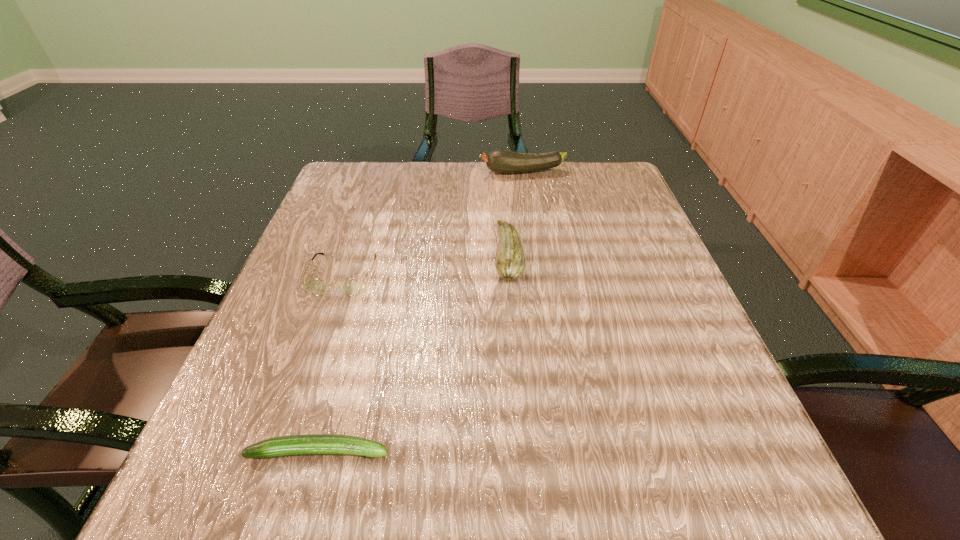
Where is `blank region between the spectacles and the leftmost zucchini`? blank region between the spectacles and the leftmost zucchini is located at coordinates (331, 363).

You are a GUI agent. You are given a task and a screenshot of the screen. Output one action in this format:
    pyautogui.click(x=<x>, y=<y>)
    Task: Click on the unoccupied area between the nearest zucchini and the second nearest zucchini
    Image resolution: width=960 pixels, height=540 pixels.
    Given the screenshot: What is the action you would take?
    pyautogui.click(x=414, y=353)

I want to click on free space between the farthest zucchini and the shortest object, so click(421, 312).

You are a GUI agent. You are given a task and a screenshot of the screen. Output one action in this format:
    pyautogui.click(x=<x>, y=<y>)
    Task: Click on the free space that is in between the farthest zucchini and the third tallest object
    
    Given the screenshot: What is the action you would take?
    [x=433, y=223]

The height and width of the screenshot is (540, 960). In order to click on free spot between the shortest object and the second farthest zucchini in this screenshot , I will do `click(414, 353)`.

In order to click on unoccupied area between the spectacles and the shortest zucchini in this screenshot , I will do `click(331, 363)`.

At what (x,y) coordinates should I click in order to perform the action: click on vacant area between the farthest zucchini and the spectacles. Please return your answer as a coordinate pair (x, y). The image size is (960, 540). Looking at the image, I should click on (433, 223).

I want to click on object that is the closest to the farthest object, so click(x=510, y=263).

Locate which object is the third closest to the shortest object. Please provide its 2D coordinates. Your answer should be formatted as a tuple, i.e. [(x, y)], where the tuple contains the x and y coordinates of a point satisfying the conditions above.

[(500, 161)]

The height and width of the screenshot is (540, 960). What are the coordinates of `the second closest zucchini to the third tallest object` in the screenshot? It's located at (312, 444).